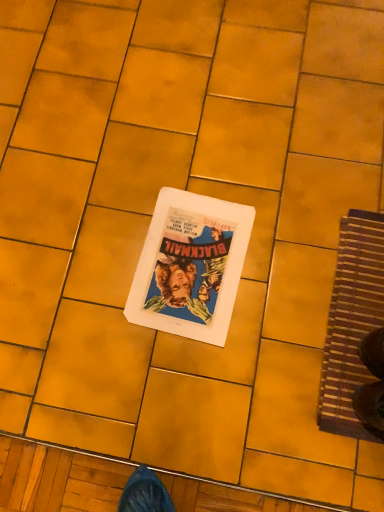
Find the location of `vacant area on top of brown woven mat at right (from a real-world perspective)`. vacant area on top of brown woven mat at right (from a real-world perspective) is located at coordinates (359, 310).